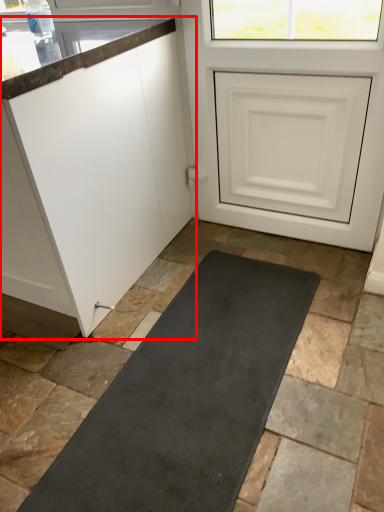
Question: Considering the relative positions of cabinetry (annotated by the red box) and door in the image provided, where is cabinetry (annotated by the red box) located with respect to the staircase?

Choices:
 (A) left
 (B) right

Answer: (A)